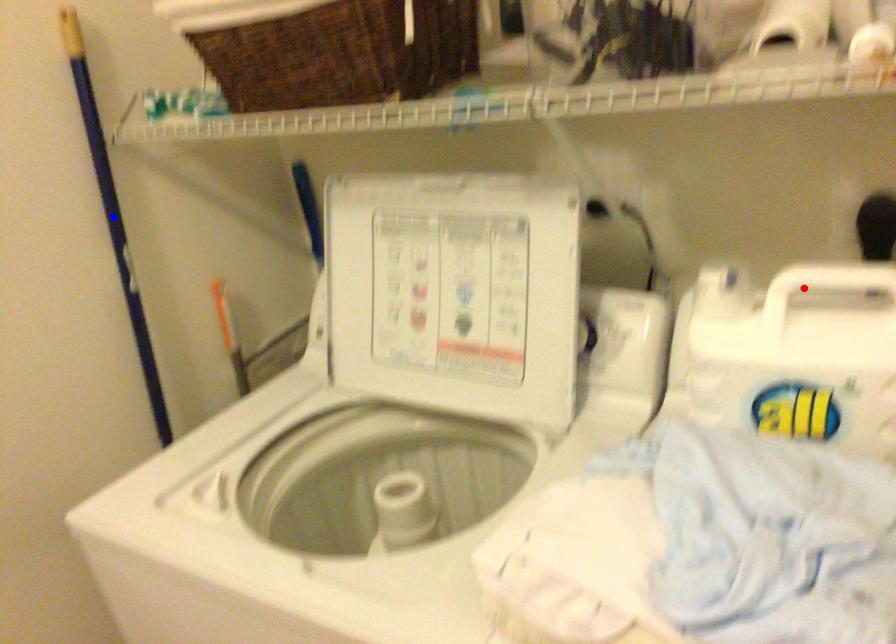
Question: Two points are marked on the image. Which point is closer to the camera?

Choices:
 (A) Blue point is closer.
 (B) Red point is closer.

Answer: (B)